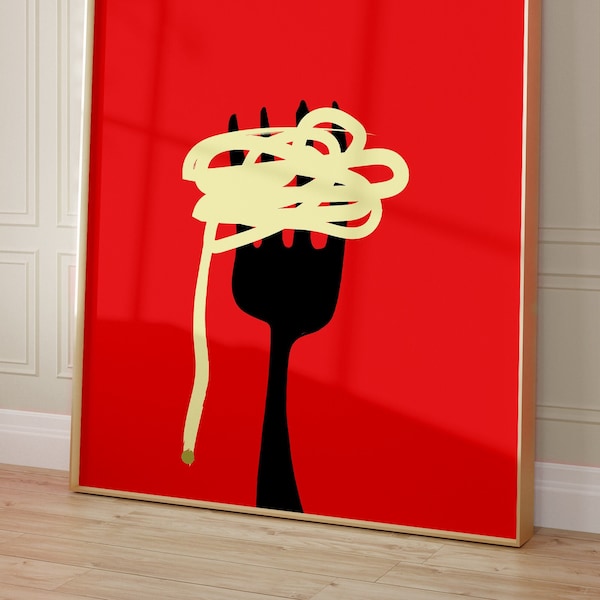
At what (x,y) coordinates should I click in order to perform the action: click on artwork. Please return your answer as a coordinate pair (x, y). Looking at the image, I should click on (510, 348).